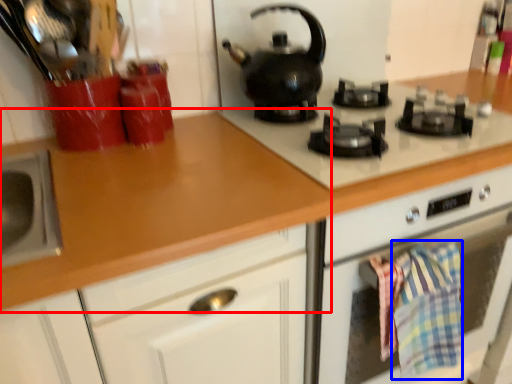
Question: Which object is further to the camera taking this photo, countertop (highlighted by a red box) or blanket (highlighted by a blue box)?

Choices:
 (A) countertop
 (B) blanket

Answer: (B)